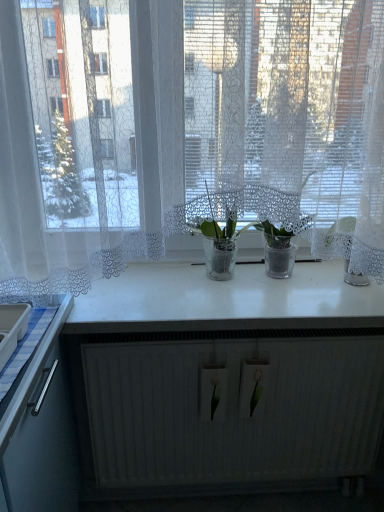
The image size is (384, 512). I want to click on white glossy counter top at center, so click(225, 300).

The height and width of the screenshot is (512, 384). What do you see at coordinates (219, 244) in the screenshot?
I see `translucent glass vase at center` at bounding box center [219, 244].

What is the approximate width of translucent glass vase at center?

translucent glass vase at center is 7.89 inches in width.

What do you see at coordinates (226, 380) in the screenshot?
I see `white matte radiator at lower center` at bounding box center [226, 380].

The image size is (384, 512). I want to click on transparent glass plants at center, so pos(188,132).

Does white glossy counter top at center touch translucent glass vase at center?

white glossy counter top at center and translucent glass vase at center are not in contact.

Is white glossy counter top at center smaller than translucent glass vase at center?

No, white glossy counter top at center is not smaller than translucent glass vase at center.

From a real-world perspective, between white glossy counter top at center and translucent glass vase at center, who is vertically higher?

translucent glass vase at center, from a real-world perspective.

Is white glossy counter top at center surrounding translucent glass vase at center?

No, white glossy counter top at center does not contain translucent glass vase at center.

Does translucent glass vase at center appear on the left side of transparent glass plants at center?

In fact, translucent glass vase at center is to the right of transparent glass plants at center.

From the image's perspective, would you say translucent glass vase at center is shown under transparent glass plants at center?

Yes, from the image's perspective, translucent glass vase at center is below transparent glass plants at center.

Which is nearer, (244, 226) or (38, 251)?

Point (244, 226) is positioned farther from the camera compared to point (38, 251).

From a real-world perspective, between translucent glass vase at center and transparent glass plants at center, who is vertically lower?

translucent glass vase at center.

Is white matte radiator at lower center turned away from translucent glass vase at center?

No, white matte radiator at lower center is not facing away from translucent glass vase at center.

Can you see white matte radiator at lower center touching translucent glass vase at center?

They are not placed beside each other.

Which of these two, white matte radiator at lower center or translucent glass vase at center, is smaller?

Smaller between the two is translucent glass vase at center.

Is point (227, 231) closer or farther from the camera than point (374, 386)?

Point (227, 231) appears to be closer to the viewer than point (374, 386).

Is translucent glass vase at center far from white matte radiator at lower center?

No, translucent glass vase at center is not far from white matte radiator at lower center.

From a real-world perspective, who is located higher, translucent glass vase at center or white matte radiator at lower center?

translucent glass vase at center is physically above.

Looking at this image, looking at their sizes, would you say translucent glass vase at center is wider or thinner than white matte radiator at lower center?

translucent glass vase at center is wider than white matte radiator at lower center.

Is white glossy counter top at center to the left of white matte radiator at lower center from the viewer's perspective?

Yes.

From the picture: From the image's perspective, between white glossy counter top at center and white matte radiator at lower center, who is located below?

white matte radiator at lower center is shown below in the image.

Consider the image. Which object is thinner, white glossy counter top at center or white matte radiator at lower center?

Thinner between the two is white matte radiator at lower center.

From a real-world perspective, is white glossy counter top at center over white matte radiator at lower center?

Yes, from a real-world perspective, white glossy counter top at center is over white matte radiator at lower center

From the image's perspective, which one is positioned lower, transparent glass plants at center or translucent glass vase at center?

From the image's view, translucent glass vase at center is below.

Is transparent glass plants at center aimed at translucent glass vase at center?

Yes, transparent glass plants at center is facing translucent glass vase at center.

Would you say transparent glass plants at center is a long distance from translucent glass vase at center?

transparent glass plants at center is actually quite close to translucent glass vase at center.

The image size is (384, 512). Find the location of `counter top that appears behind the transparent glass plants at center`. counter top that appears behind the transparent glass plants at center is located at coordinates (225, 300).

Would you say transparent glass plants at center is outside white glossy counter top at center?

Indeed, transparent glass plants at center is completely outside white glossy counter top at center.

Measure the distance between transparent glass plants at center and white glossy counter top at center.

transparent glass plants at center and white glossy counter top at center are 14.77 inches apart.

Can you see transparent glass plants at center touching white glossy counter top at center?

No, transparent glass plants at center is not next to white glossy counter top at center.

Identify the location of counter top located in front of the translucent glass vase at center. (225, 300).

What are the coordinates of `houseplant that is behind the transparent glass plants at center` in the screenshot? It's located at (219, 244).

From the picture: Which object lies nearer to the anchor point white matte radiator at lower center, translucent glass vase at center or transparent glass plants at center?

The object closer to white matte radiator at lower center is translucent glass vase at center.

Looking at this image, which object lies nearer to the anchor point transparent glass plants at center, white matte radiator at lower center or white glossy counter top at center?

white glossy counter top at center.

From the image, which object appears to be nearer to translucent glass vase at center, white glossy counter top at center or transparent glass plants at center?

white glossy counter top at center.

Looking at the image, which one is located closer to white matte radiator at lower center, transparent glass plants at center or white glossy counter top at center?

Among the two, white glossy counter top at center is located nearer to white matte radiator at lower center.

Looking at this image, based on their spatial positions, is white matte radiator at lower center or translucent glass vase at center closer to white glossy counter top at center?

white matte radiator at lower center lies closer to white glossy counter top at center than the other object.

When comparing their distances from white glossy counter top at center, does translucent glass vase at center or transparent glass plants at center seem further?

Among the two, transparent glass plants at center is located further to white glossy counter top at center.

Looking at this image, when comparing their distances from white glossy counter top at center, does transparent glass plants at center or translucent glass vase at center seem further?

Based on the image, transparent glass plants at center appears to be further to white glossy counter top at center.

Based on their spatial positions, is white matte radiator at lower center or white glossy counter top at center closer to translucent glass vase at center?

white glossy counter top at center lies closer to translucent glass vase at center than the other object.

This screenshot has width=384, height=512. Identify the location of houseplant between transparent glass plants at center and white matte radiator at lower center vertically. (219, 244).

Locate an element on the screen. The height and width of the screenshot is (512, 384). counter top that lies between translucent glass vase at center and white matte radiator at lower center from top to bottom is located at coordinates click(x=225, y=300).

I want to click on counter top between transparent glass plants at center and white matte radiator at lower center from top to bottom, so click(x=225, y=300).

Image resolution: width=384 pixels, height=512 pixels. I want to click on counter top positioned between transparent glass plants at center and translucent glass vase at center from near to far, so click(x=225, y=300).